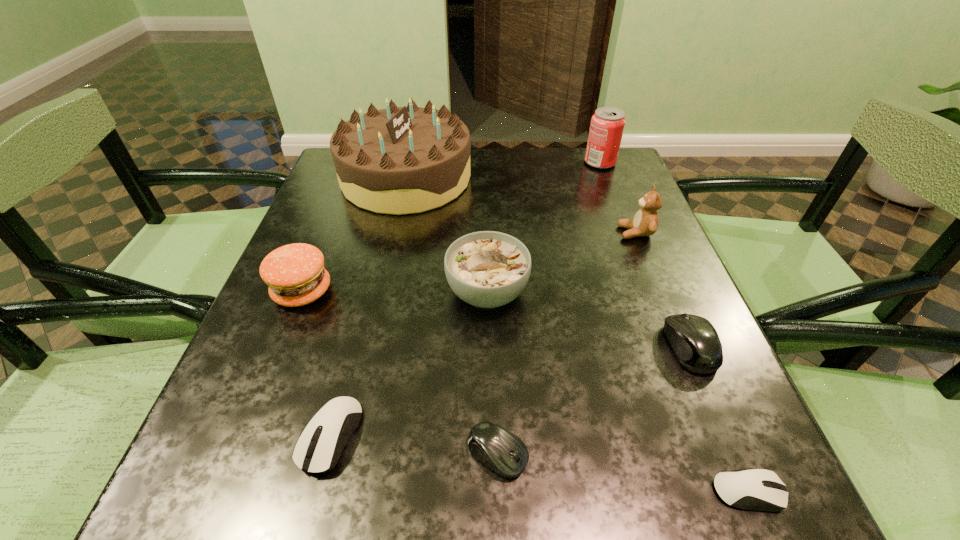
Find the location of a particular element. The width and height of the screenshot is (960, 540). brown birthday cake is located at coordinates (400, 160).

Locate an element on the screen. The height and width of the screenshot is (540, 960). birthday cake is located at coordinates (400, 160).

You are a GUI agent. You are given a task and a screenshot of the screen. Output one action in this format:
    pyautogui.click(x=<x>, y=<y>)
    Task: Click on the soda can
    This screenshot has width=960, height=540.
    Given the screenshot: What is the action you would take?
    pyautogui.click(x=607, y=125)

The height and width of the screenshot is (540, 960). I want to click on teddy bear, so click(645, 222).

Identify the location of the seventh nearest object. The width and height of the screenshot is (960, 540). (645, 222).

You are a GUI agent. You are given a task and a screenshot of the screen. Output one action in this format:
    pyautogui.click(x=<x>, y=<y>)
    Task: Click on the soup bowl
    
    Given the screenshot: What is the action you would take?
    pyautogui.click(x=487, y=269)

Identify the location of patty. (295, 274).

Where is `the farther black mouse`? Image resolution: width=960 pixels, height=540 pixels. the farther black mouse is located at coordinates (694, 340).

This screenshot has height=540, width=960. What are the coordinates of `the bigger black mouse` in the screenshot? It's located at (694, 340).

Locate an element on the screen. the bigger white mouse is located at coordinates (337, 420).